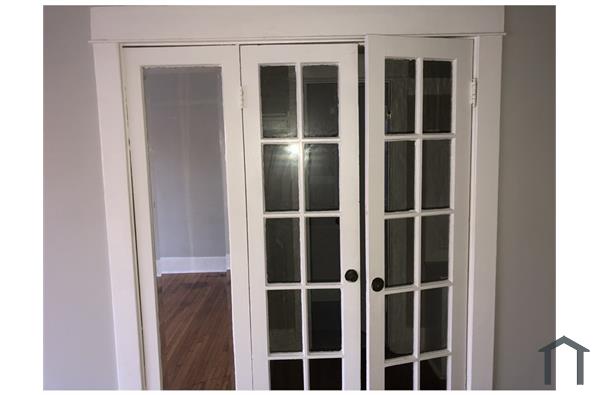
The height and width of the screenshot is (395, 600). I want to click on floor, so pos(186,315).